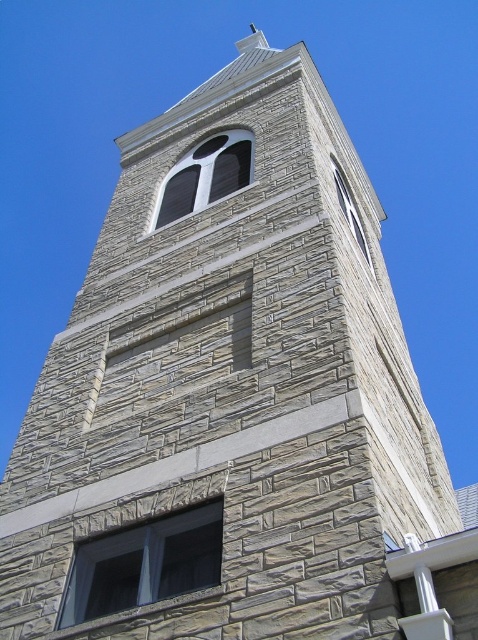
Question: Where is matte glass window at center located in relation to smooth stone window at upper center in the image?

Choices:
 (A) below
 (B) above

Answer: (B)

Question: Which is nearer to the smooth stone window at upper center?

Choices:
 (A) matte glass window at center
 (B) matte gray stone window at center

Answer: (A)

Question: Which point is farther to the camera?

Choices:
 (A) (356, 230)
 (B) (118, 564)
 (C) (186, 196)

Answer: (A)

Question: Is matte gray stone window at center to the right of smooth stone window at upper center from the viewer's perspective?

Choices:
 (A) yes
 (B) no

Answer: (B)

Question: Observing the image, what is the correct spatial positioning of matte gray stone window at center in reference to smooth stone window at upper center?

Choices:
 (A) below
 (B) above

Answer: (A)

Question: Which point is farther to the camera?

Choices:
 (A) 359,228
 (B) 138,561

Answer: (A)